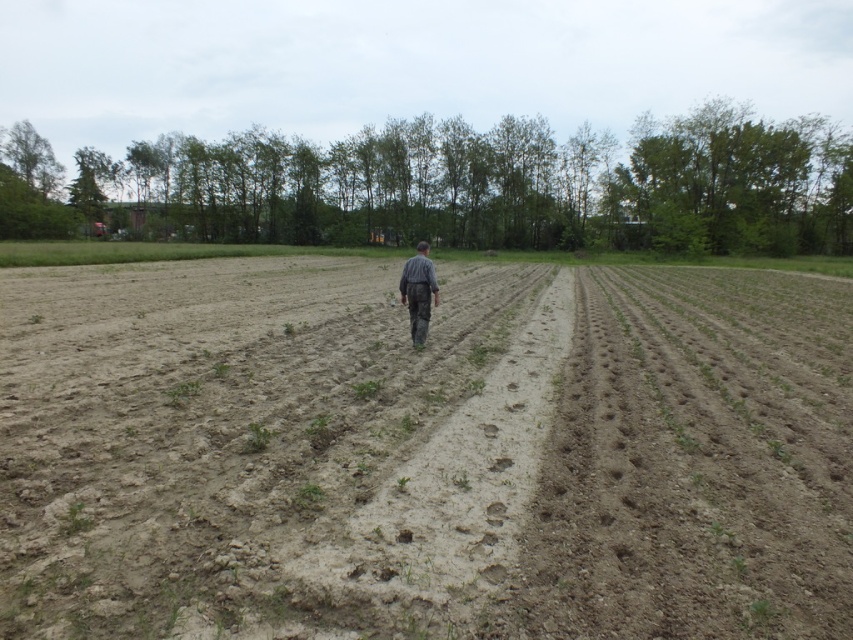
Is brown soil at center below gray striped shirt at center?

Indeed, brown soil at center is positioned under gray striped shirt at center.

At what (x,y) coordinates should I click in order to perform the action: click on brown soil at center. Please return your answer as a coordinate pair (x, y). This screenshot has width=853, height=640. Looking at the image, I should click on (422, 451).